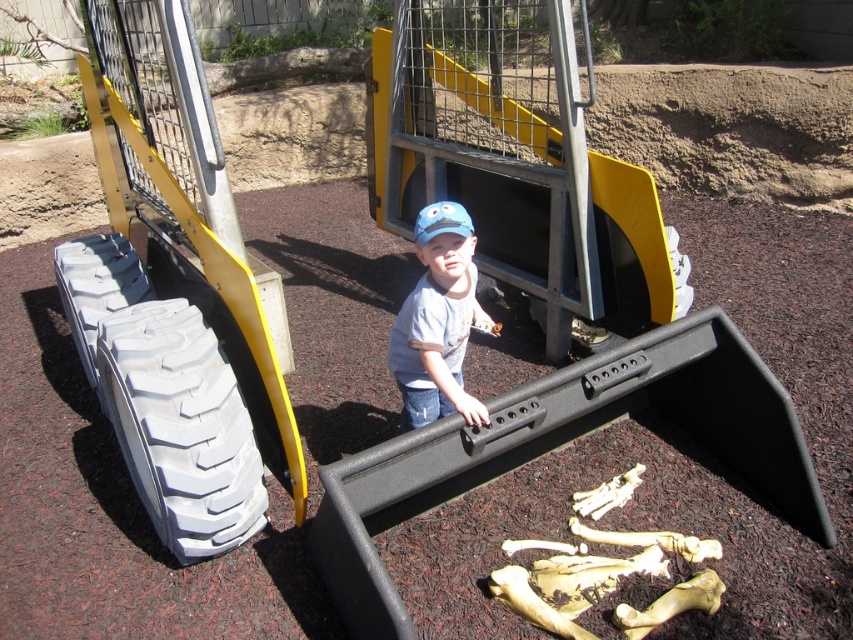
Can you confirm if white rubber tire at lower left is bigger than gray rubber tire at lower left?

Actually, white rubber tire at lower left might be smaller than gray rubber tire at lower left.

Where is `white rubber tire at lower left`? Image resolution: width=853 pixels, height=640 pixels. white rubber tire at lower left is located at coordinates (181, 428).

Does white rubber tire at lower left appear on the right side of matte blue cap at center?

No, white rubber tire at lower left is not to the right of matte blue cap at center.

Between point (239, 428) and point (461, 272), which one is positioned behind?

Positioned behind is point (461, 272).

Locate an element on the screen. The width and height of the screenshot is (853, 640). white rubber tire at lower left is located at coordinates (181, 428).

I want to click on matte blue cap at center, so [x=438, y=321].

Is matte blue cap at center above gray rubber tire at lower left?

Actually, matte blue cap at center is below gray rubber tire at lower left.

Find the location of `matte blue cap at center`. matte blue cap at center is located at coordinates (438, 321).

Find the location of a particular element. Image resolution: width=853 pixels, height=640 pixels. matte blue cap at center is located at coordinates (438, 321).